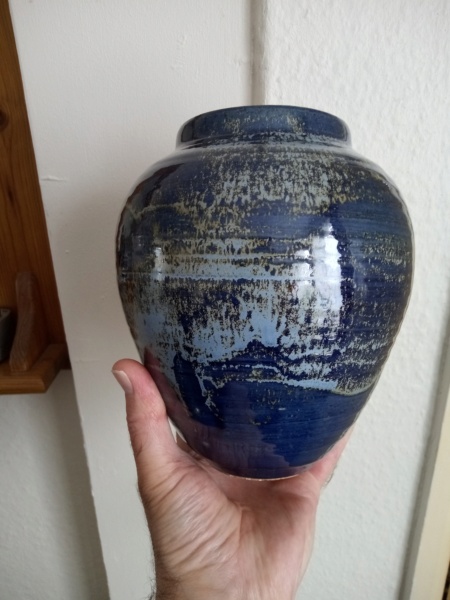
In order to click on vase in this screenshot , I will do `click(284, 123)`.